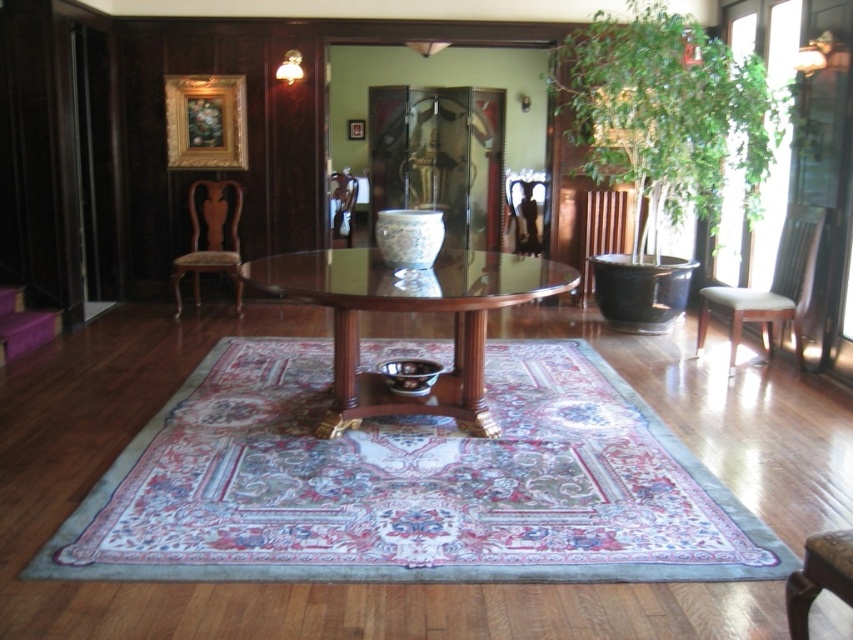
Question: Which is farther from the glossy wood table at center?

Choices:
 (A) green leafy plant at upper right
 (B) brown leather chair at lower right

Answer: (A)

Question: Which point appears closest to the camera in this image?

Choices:
 (A) (802, 579)
 (B) (665, 40)

Answer: (A)

Question: Which object is positioned closest to the glossy wood table at center?

Choices:
 (A) black wood chair at right
 (B) brown wood/leather armchair at left
 (C) matte brown armchair at center

Answer: (B)

Question: Can you confirm if green leafy plant at upper right is positioned above light brown wood armchair at right?

Choices:
 (A) no
 (B) yes

Answer: (B)

Question: Can you confirm if light brown wood armchair at right is positioned below matte brown armchair at center?

Choices:
 (A) yes
 (B) no

Answer: (A)

Question: Is green leafy plant at upper right below black wood chair at right?

Choices:
 (A) no
 (B) yes

Answer: (A)